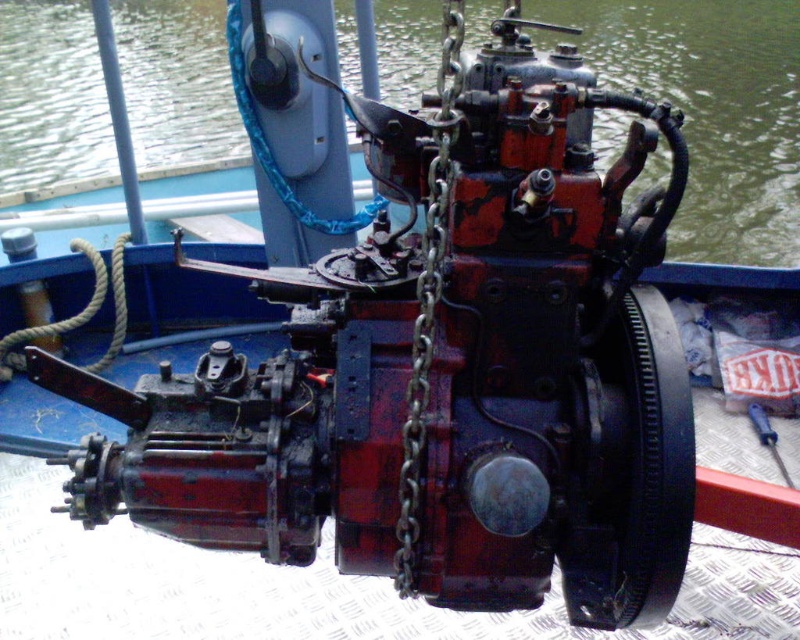
You are a mechanic working on a boat engine. You need to determine if the rusty metal engine at center can fit through a narrow opening that is the same width as the rusty metal chain at center. Based on the scene, can the engine pass through the opening?

The rusty metal engine at center might be wider than the rusty metal chain at center, so there is a possibility that the engine cannot pass through the opening if the chain is used as a reference for width.